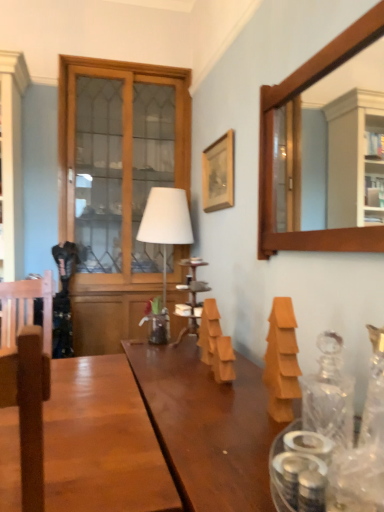
Question: Is the position of wooden picture frame at upper center more distant than that of transparent glass decanter at right?

Choices:
 (A) yes
 (B) no

Answer: (A)

Question: Considering the relative sizes of wooden picture frame at upper center and transparent glass decanter at right in the image provided, is wooden picture frame at upper center bigger than transparent glass decanter at right?

Choices:
 (A) no
 (B) yes

Answer: (B)

Question: Can you confirm if wooden picture frame at upper center is positioned to the right of transparent glass decanter at right?

Choices:
 (A) yes
 (B) no

Answer: (B)

Question: Is transparent glass decanter at right inside wooden picture frame at upper center?

Choices:
 (A) no
 (B) yes

Answer: (A)

Question: Is wooden picture frame at upper center shorter than transparent glass decanter at right?

Choices:
 (A) no
 (B) yes

Answer: (A)

Question: Considering the relative sizes of wooden picture frame at upper center and transparent glass decanter at right in the image provided, is wooden picture frame at upper center smaller than transparent glass decanter at right?

Choices:
 (A) yes
 (B) no

Answer: (B)

Question: Is wooden picture frame at upper center looking in the opposite direction of white matte table lamp at center?

Choices:
 (A) yes
 (B) no

Answer: (B)

Question: Is wooden picture frame at upper center not close to white matte table lamp at center?

Choices:
 (A) no
 (B) yes

Answer: (A)

Question: From the image's perspective, would you say wooden picture frame at upper center is positioned over white matte table lamp at center?

Choices:
 (A) yes
 (B) no

Answer: (A)

Question: From the image's perspective, would you say wooden picture frame at upper center is shown under white matte table lamp at center?

Choices:
 (A) yes
 (B) no

Answer: (B)

Question: Is wooden picture frame at upper center positioned in front of white matte table lamp at center?

Choices:
 (A) no
 (B) yes

Answer: (B)

Question: Does wooden picture frame at upper center have a greater width compared to white matte table lamp at center?

Choices:
 (A) yes
 (B) no

Answer: (B)

Question: From the image's perspective, is wooden frame mirror at upper right located above wooden picture frame at upper center?

Choices:
 (A) no
 (B) yes

Answer: (A)